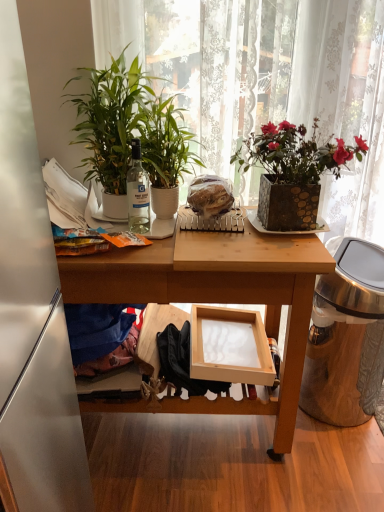
What do you see at coordinates (138, 192) in the screenshot? I see `clear glass bottle at center` at bounding box center [138, 192].

What is the approximate height of translucent plastic bread at center?

It is 12.74 centimeters.

I want to click on white matte refrigerator at left, so click(x=32, y=313).

This screenshot has width=384, height=512. What are the coordinates of `wooden table at center` in the screenshot? It's located at (217, 297).

Where is `green leafy plant at center, placed as the first houseplant when sorted from right to left`? The image size is (384, 512). green leafy plant at center, placed as the first houseplant when sorted from right to left is located at coordinates (165, 152).

You are a GUI agent. You are given a task and a screenshot of the screen. Output one action in this format:
    pyautogui.click(x=<x>, y=<y>)
    Task: Click on the clear glass bottle at center
    This screenshot has width=384, height=512.
    Given the screenshot: What is the action you would take?
    pyautogui.click(x=138, y=192)

Looking at this image, based on their sizes in the image, would you say shiny metallic trash can at right is bigger or smaller than white lace curtain at upper center?

Clearly, shiny metallic trash can at right is smaller in size than white lace curtain at upper center.

Which point is more distant from viewer, (382, 339) or (160, 89)?

The point (382, 339) is behind.

Is shiny metallic trash can at right wider or thinner than white lace curtain at upper center?

Clearly, shiny metallic trash can at right has more width compared to white lace curtain at upper center.

Looking at this image, between wooden table at center and translucent plastic bread at center, which one appears on the right side from the viewer's perspective?

translucent plastic bread at center.

Considering the sizes of objects wooden table at center and translucent plastic bread at center in the image provided, who is bigger, wooden table at center or translucent plastic bread at center?

With larger size is wooden table at center.

Which object is further away from the camera, wooden table at center or translucent plastic bread at center?

translucent plastic bread at center is further from the camera.

In terms of width, does clear glass bottle at center look wider or thinner when compared to wooden table at center?

In the image, clear glass bottle at center appears to be more narrow than wooden table at center.

Could wooden table at center be considered to be inside clear glass bottle at center?

That's incorrect, wooden table at center is not inside clear glass bottle at center.

Is clear glass bottle at center touching wooden table at center?

No.

Which is closer, (128, 177) or (275, 451)?

The point (128, 177) is closer to the camera.

Could you tell me if blue cotton clothing at lower left is facing clear glass bottle at center?

No, blue cotton clothing at lower left is not oriented towards clear glass bottle at center.

Looking at the image, does blue cotton clothing at lower left seem bigger or smaller compared to clear glass bottle at center?

Clearly, blue cotton clothing at lower left is larger in size than clear glass bottle at center.

Would you say blue cotton clothing at lower left is to the left or to the right of clear glass bottle at center in the picture?

blue cotton clothing at lower left is to the left of clear glass bottle at center.

Based on the photo, is blue cotton clothing at lower left in front of or behind white matte refrigerator at left in the image?

blue cotton clothing at lower left is positioned farther from the viewer than white matte refrigerator at left.

Does blue cotton clothing at lower left appear on the right side of white matte refrigerator at left?

In fact, blue cotton clothing at lower left is to the left of white matte refrigerator at left.

From a real-world perspective, is blue cotton clothing at lower left located higher than white matte refrigerator at left?

No, from a real-world perspective, blue cotton clothing at lower left is not over white matte refrigerator at left

In terms of height, does blue cotton clothing at lower left look taller or shorter compared to white matte refrigerator at left?

blue cotton clothing at lower left is shorter than white matte refrigerator at left.

Which is more to the right, shiny metallic trash can at right or clear glass bottle at center?

shiny metallic trash can at right.

From the image's perspective, which is below, shiny metallic trash can at right or clear glass bottle at center?

shiny metallic trash can at right appears lower in the image.

Which is behind, shiny metallic trash can at right or clear glass bottle at center?

shiny metallic trash can at right is further from the camera.

Find the location of a particular element. The width and height of the screenshot is (384, 512). clothing that appears behind the wooden table at center is located at coordinates (98, 329).

Considering the sizes of objects wooden table at center and blue cotton clothing at lower left in the image provided, who is wider, wooden table at center or blue cotton clothing at lower left?

wooden table at center is wider.

In the image, is wooden table at center positioned in front of or behind blue cotton clothing at lower left?

wooden table at center is in front of blue cotton clothing at lower left.

Is wooden table at center not close to blue cotton clothing at lower left?

They are positioned close to each other.

In order to click on curtain on the left of shiny metallic trash can at right in this screenshot , I will do `click(267, 81)`.

Identify the location of table lying below the translucent plastic bread at center (from the image's perspective). (217, 297).

Estimate the real-world distances between objects in this image. Which object is closer to wooden table at center, blue cotton clothing at lower left or clear glass bottle at center?

blue cotton clothing at lower left lies closer to wooden table at center than the other object.

Looking at the image, which one is located further to blue cotton clothing at lower left, translucent plastic bread at center or green glossy plant at left, the 1th houseplant positioned from the left?

green glossy plant at left, the 1th houseplant positioned from the left, is positioned further to the anchor blue cotton clothing at lower left.

When comparing their distances from green leafy plant at center, which appears as the second houseplant when viewed from the left, does shiny metallic trash can at right or green glossy plant at left, the 1th houseplant positioned from the left, seem closer?

green glossy plant at left, the 1th houseplant positioned from the left.

Looking at the image, which one is located further to green glossy plant at left, the 1th houseplant positioned from the left, green leafy plant at center, which appears as the second houseplant when viewed from the left, or shiny metallic trash can at right?

Among the two, shiny metallic trash can at right is located further to green glossy plant at left, the 1th houseplant positioned from the left.

Based on their spatial positions, is white lace curtain at upper center or wooden table at center closer to shiny metallic trash can at right?

wooden table at center lies closer to shiny metallic trash can at right than the other object.

Which object lies nearer to the anchor point white lace curtain at upper center, clear glass bottle at center or translucent plastic bread at center?

translucent plastic bread at center is positioned closer to the anchor white lace curtain at upper center.

Looking at this image, which object lies nearer to the anchor point translucent plastic bread at center, green leafy plant at center, which appears as the second houseplant when viewed from the left, or white lace curtain at upper center?

Among the two, green leafy plant at center, which appears as the second houseplant when viewed from the left, is located nearer to translucent plastic bread at center.

Based on their spatial positions, is white matte refrigerator at left or white lace curtain at upper center closer to translucent plastic bread at center?

Among the two, white lace curtain at upper center is located nearer to translucent plastic bread at center.

The height and width of the screenshot is (512, 384). I want to click on box between green glossy plant at left, the second houseplant when ordered from right to left, and blue cotton clothing at lower left in the up-down direction, so tap(229, 346).

This screenshot has height=512, width=384. I want to click on curtain between clear glass bottle at center and wooden frame at lower center from top to bottom, so click(267, 81).

Identify the location of clothing between white matte refrigerator at left and wooden frame at lower center in the front-back direction. Image resolution: width=384 pixels, height=512 pixels. (98, 329).

This screenshot has height=512, width=384. In order to click on food between white matte refrigerator at left and wooden frame at lower center along the z-axis in this screenshot , I will do `click(210, 195)`.